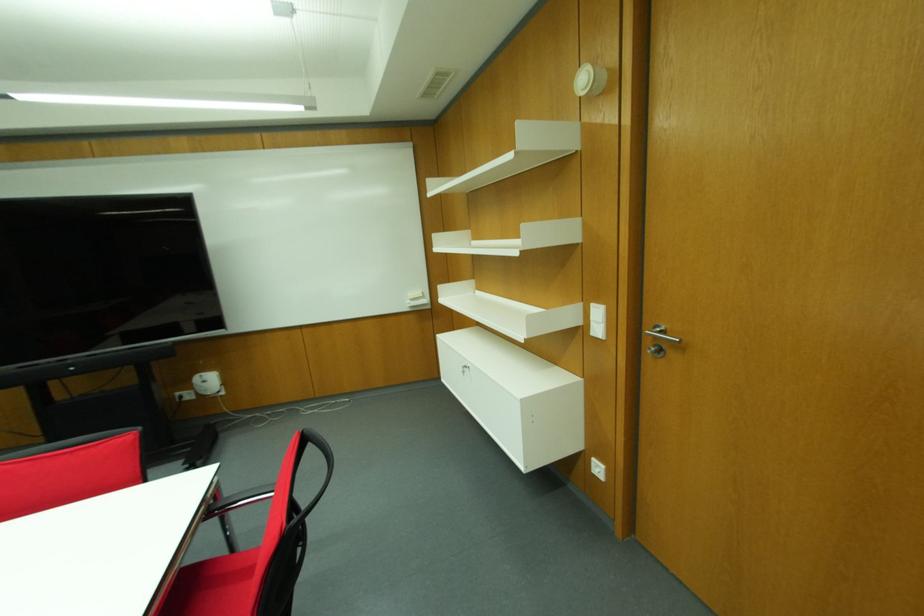
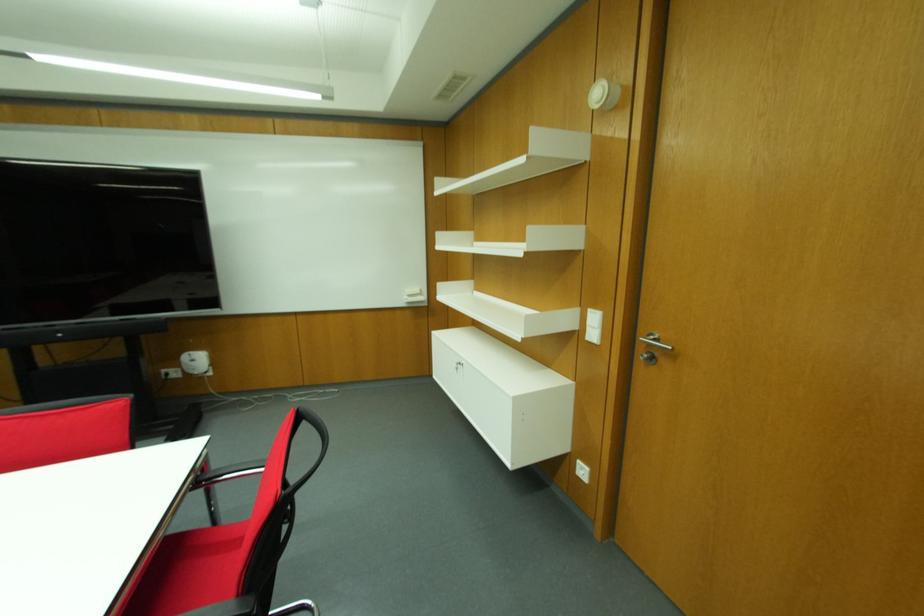
Locate, in the second image, the point that corresponds to (x=208, y=507) in the first image.

(197, 477)